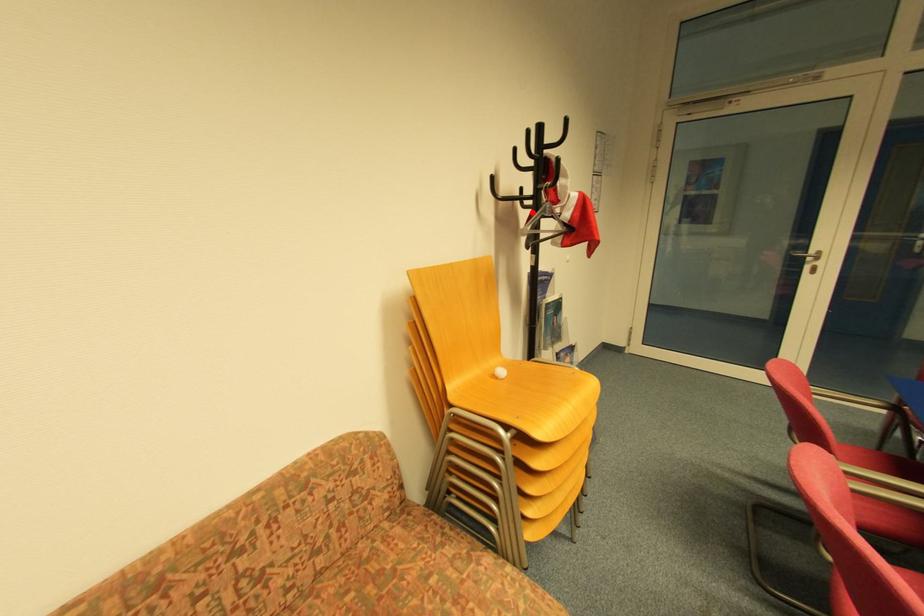
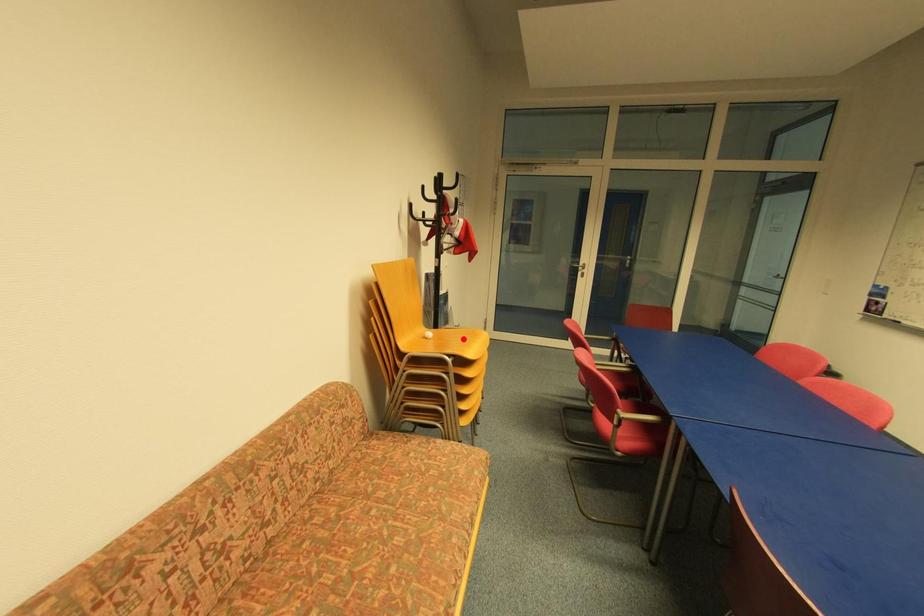
I am providing you with two images of the same scene from different viewpoints. A red point is marked on the first image and another point is marked on the second image. Are the points marked in image1 and image2 representing the same 3D position?

No